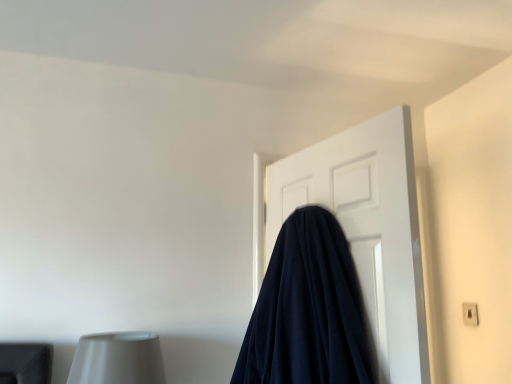
Question: Does navy blue fabric at center have a lesser height compared to white plastic electric outlet at upper right?

Choices:
 (A) no
 (B) yes

Answer: (A)

Question: Is navy blue fabric at center directly adjacent to white plastic electric outlet at upper right?

Choices:
 (A) yes
 (B) no

Answer: (B)

Question: Is navy blue fabric at center not inside white plastic electric outlet at upper right?

Choices:
 (A) yes
 (B) no

Answer: (A)

Question: Is navy blue fabric at center to the left of white plastic electric outlet at upper right from the viewer's perspective?

Choices:
 (A) yes
 (B) no

Answer: (A)

Question: Can you confirm if navy blue fabric at center is thinner than white plastic electric outlet at upper right?

Choices:
 (A) yes
 (B) no

Answer: (B)

Question: Is white plastic electric outlet at upper right in front of or behind navy blue fabric at center in the image?

Choices:
 (A) behind
 (B) front

Answer: (A)

Question: Is white plastic electric outlet at upper right taller or shorter than navy blue fabric at center?

Choices:
 (A) short
 (B) tall

Answer: (A)

Question: Does point (461, 306) appear closer or farther from the camera than point (245, 347)?

Choices:
 (A) farther
 (B) closer

Answer: (A)

Question: From the image's perspective, is white plastic electric outlet at upper right positioned above or below navy blue fabric at center?

Choices:
 (A) below
 (B) above

Answer: (A)

Question: Looking at their shapes, would you say navy blue fabric at center is wider or thinner than white plastic electric outlet at upper right?

Choices:
 (A) thin
 (B) wide

Answer: (B)

Question: Is navy blue fabric at center taller or shorter than white plastic electric outlet at upper right?

Choices:
 (A) short
 (B) tall

Answer: (B)

Question: Would you say navy blue fabric at center is inside or outside white plastic electric outlet at upper right?

Choices:
 (A) inside
 (B) outside

Answer: (B)

Question: Considering their positions, is navy blue fabric at center located in front of or behind white plastic electric outlet at upper right?

Choices:
 (A) front
 (B) behind

Answer: (A)

Question: Considering their positions, is navy blue fabric at center located in front of or behind white plastic electric outlet at upper right?

Choices:
 (A) front
 (B) behind

Answer: (A)

Question: Is navy blue fabric at center bigger or smaller than white plastic electric outlet at upper right?

Choices:
 (A) big
 (B) small

Answer: (A)